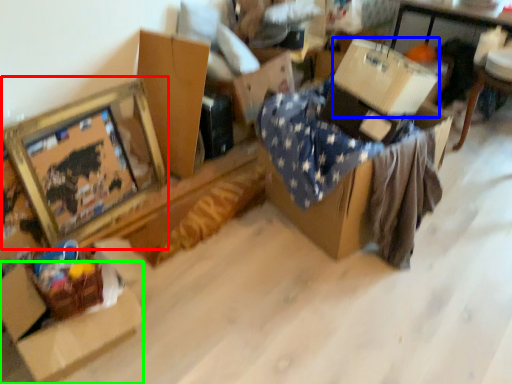
Question: Estimate the real-world distances between objects in this image. Which object is farther from picture frame (highlighted by a red box), cardboard box (highlighted by a blue box) or cardboard box (highlighted by a green box)?

Choices:
 (A) cardboard box
 (B) cardboard box

Answer: (A)